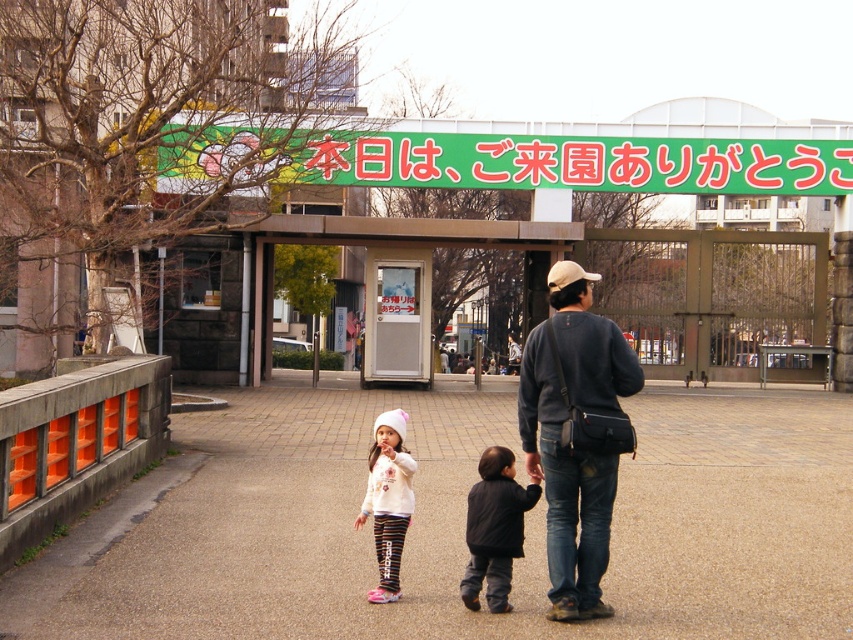
Is brown concrete pavement at center bigger than white soft hat at center?

Yes, brown concrete pavement at center is bigger than white soft hat at center.

Is point (722, 602) in front of point (381, 480)?

No, (722, 602) is further to viewer.

Where is `brown concrete pavement at center`? The width and height of the screenshot is (853, 640). brown concrete pavement at center is located at coordinates (460, 524).

Is brown concrete pavement at center below dark gray sweater at center?

Indeed, brown concrete pavement at center is positioned under dark gray sweater at center.

Which is more to the left, brown concrete pavement at center or dark gray sweater at center?

brown concrete pavement at center

Find the location of a particular element. The image size is (853, 640). brown concrete pavement at center is located at coordinates (460, 524).

You are a GUI agent. You are given a task and a screenshot of the screen. Output one action in this format:
    pyautogui.click(x=<x>, y=<y>)
    Task: Click on the brown concrete pavement at center
    The height and width of the screenshot is (640, 853).
    Given the screenshot: What is the action you would take?
    pyautogui.click(x=460, y=524)

Between dark gray sweater at center and white soft hat at center, which one appears on the left side from the viewer's perspective?

Positioned to the left is white soft hat at center.

From the picture: Does dark gray sweater at center appear under white soft hat at center?

Actually, dark gray sweater at center is above white soft hat at center.

Between point (593, 442) and point (355, 525), which one is positioned behind?

Positioned behind is point (355, 525).

Locate an element on the screen. This screenshot has height=640, width=853. dark gray sweater at center is located at coordinates (575, 435).